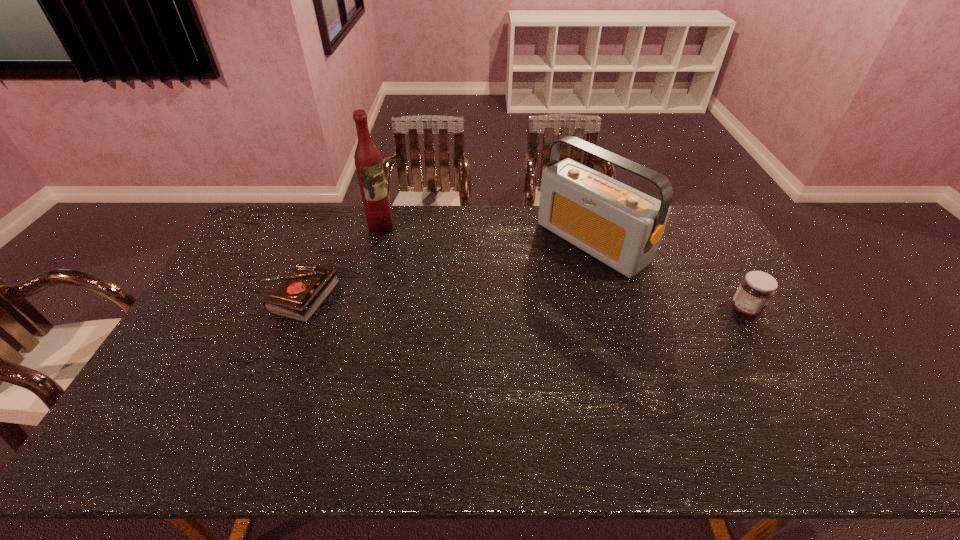
Identify the location of free space between the jam and the liquor. The height and width of the screenshot is (540, 960). (563, 269).

Identify which object is located as the third nearest to the jam. Please provide its 2D coordinates. Your answer should be formatted as a tuple, i.e. [(x, y)], where the tuple contains the x and y coordinates of a point satisfying the conditions above.

[(300, 294)]

At what (x,y) coordinates should I click in order to perform the action: click on object that is the third closest to the third tallest object. Please return your answer as a coordinate pair (x, y). Looking at the image, I should click on (300, 294).

The image size is (960, 540). Identify the location of vacant point that satisfies the following two spatial constraints: 1. on the front side of the jam; 2. on the front label of the leftmost object. (294, 310).

Identify the location of free space that satisfies the following two spatial constraints: 1. on the front side of the second object from left to right; 2. on the front label of the jam. (358, 310).

I want to click on blank space that satisfies the following two spatial constraints: 1. on the front side of the tallest object; 2. on the right side of the second object from right to left, so click(377, 242).

The width and height of the screenshot is (960, 540). Identify the location of vacant space that satisfies the following two spatial constraints: 1. on the front side of the rightmost object; 2. on the front label of the radio receiver. (612, 310).

Identify the location of blank space that satisfies the following two spatial constraints: 1. on the back side of the shortest object; 2. on the left side of the second object from right to left. The width and height of the screenshot is (960, 540). (323, 242).